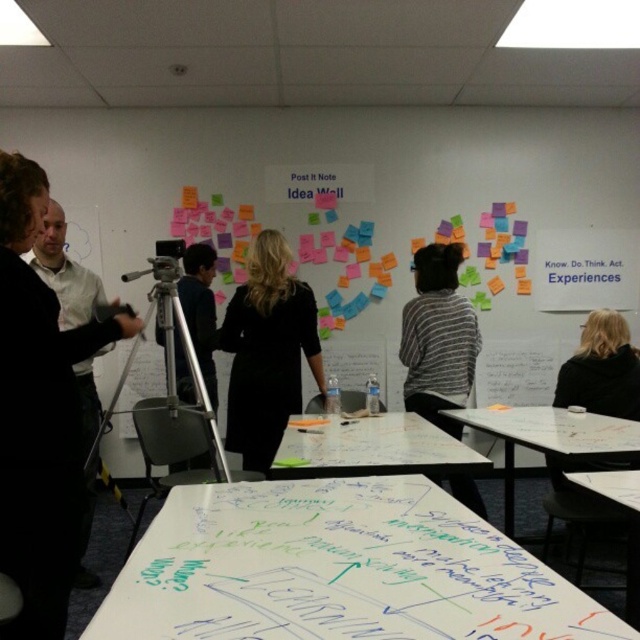
Question: From the image, what is the correct spatial relationship of white glossy table at center in relation to white paperboard at lower right?

Choices:
 (A) right
 (B) left

Answer: (B)

Question: Which point is farther to the camera?

Choices:
 (A) white glossy table at center
 (B) black fabric shirt at left
 (C) striped sweater at center

Answer: (C)

Question: From the image, what is the correct spatial relationship of striped sweater at center in relation to blonde hair at upper right?

Choices:
 (A) above
 (B) below

Answer: (B)

Question: Does white paperboard at center appear over silver metallic tripod at center-left?

Choices:
 (A) yes
 (B) no

Answer: (B)

Question: Which object appears farthest from the camera in this image?

Choices:
 (A) whiteboard paper at center
 (B) black matte dress at center
 (C) blonde hair at upper right
 (D) white paperboard at lower right

Answer: (C)

Question: Which point is closer to the camera taking this photo?

Choices:
 (A) (289, 454)
 (B) (268, 413)
 (C) (426, 376)
 (D) (636, 484)

Answer: (D)